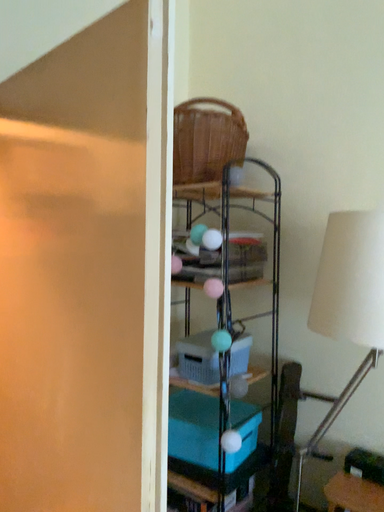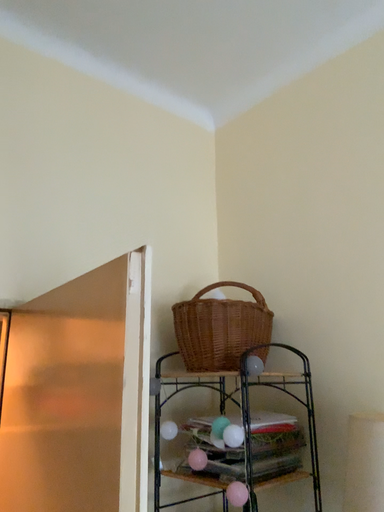
Question: How did the camera likely rotate when shooting the video?

Choices:
 (A) rotated left
 (B) rotated right

Answer: (A)